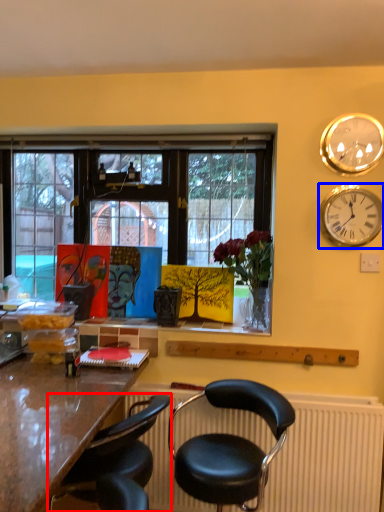
Question: Which of the following is the closest to the observer, chair (highlighted by a red box) or wall clock (highlighted by a blue box)?

Choices:
 (A) chair
 (B) wall clock

Answer: (A)